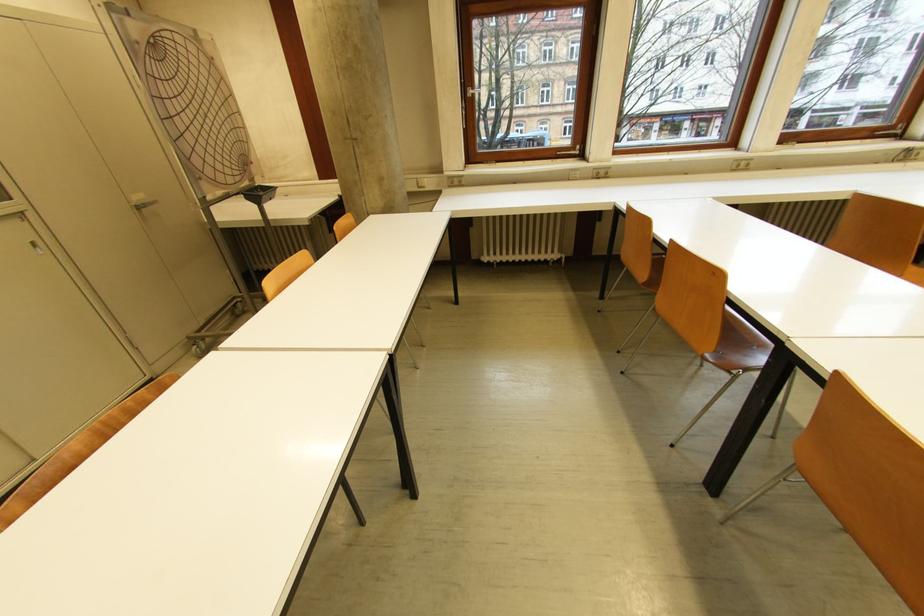
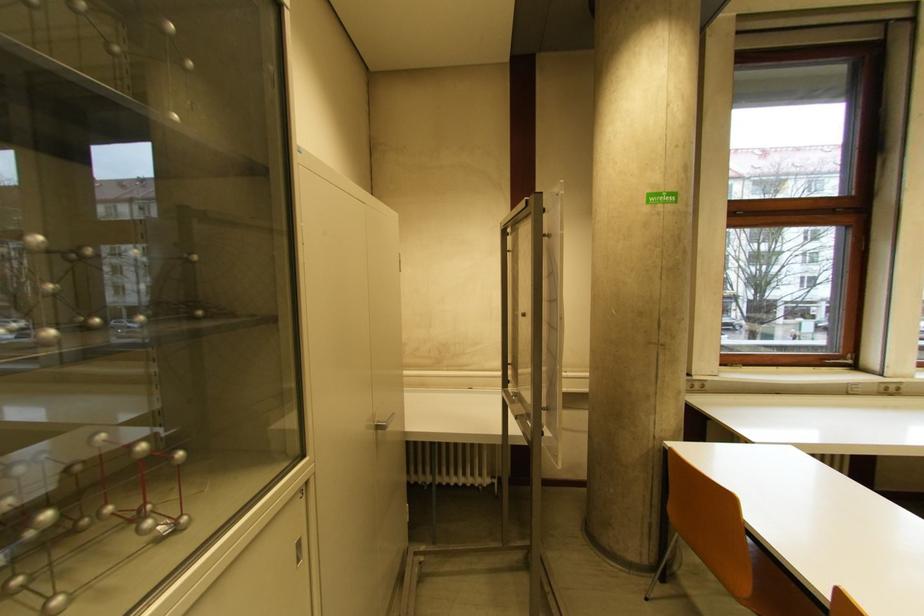
Locate, in the second image, the point that corresponds to point 144,209 in the first image.

(385, 429)